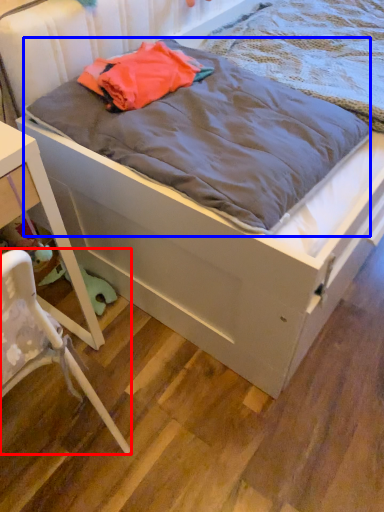
Question: Which point is further to the camera, chair (highlighted by a red box) or blanket (highlighted by a blue box)?

Choices:
 (A) chair
 (B) blanket

Answer: (B)